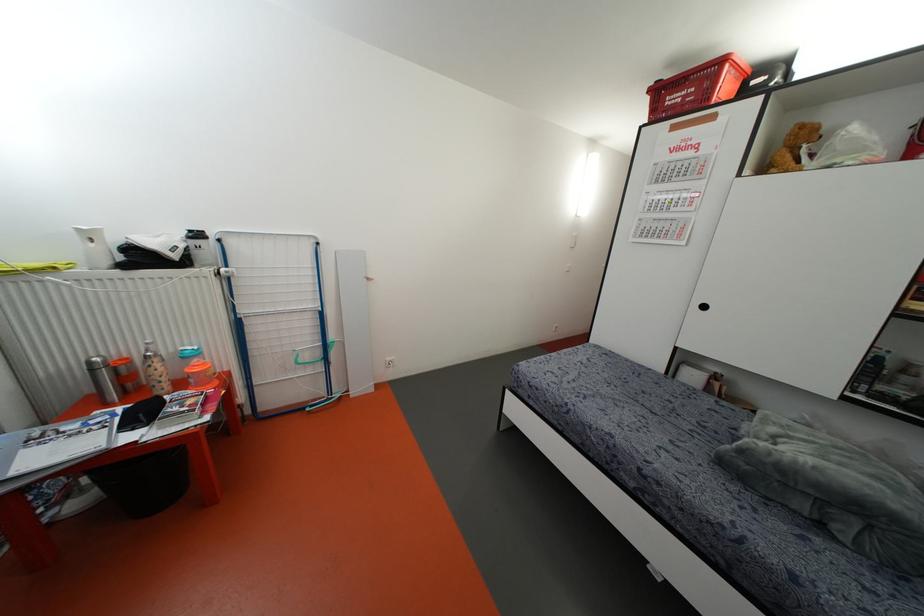
Where would you lift the brown teddy bear? Please return your answer as a coordinate pair (x, y).

(793, 148)